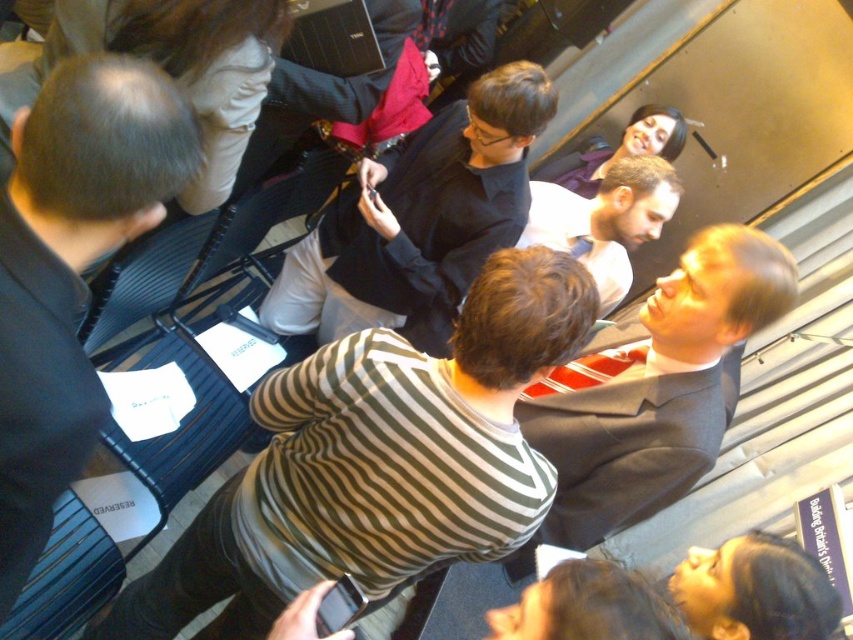
Does black shirt at left have a lesser width compared to black glossy shirt at center?

Yes, black shirt at left is thinner than black glossy shirt at center.

Find the location of a particular element. black shirt at left is located at coordinates (70, 269).

Find the location of a particular element. Image resolution: width=853 pixels, height=640 pixels. black shirt at left is located at coordinates (70, 269).

Find the location of a particular element. black shirt at left is located at coordinates (70, 269).

Is striped cotton shirt at center positioned before black glossy shirt at center?

That is True.

Measure the distance between striped cotton shirt at center and camera.

striped cotton shirt at center and camera are 3.61 feet apart.

The height and width of the screenshot is (640, 853). I want to click on striped cotton shirt at center, so click(x=376, y=461).

Where is `striped cotton shirt at center`? The height and width of the screenshot is (640, 853). striped cotton shirt at center is located at coordinates (376, 461).

Can you confirm if black shirt at left is shorter than dark gray suit at center?

In fact, black shirt at left may be taller than dark gray suit at center.

Is point (74, 381) positioned after point (612, 250)?

No, (74, 381) is in front of (612, 250).

Find the location of a particular element. This screenshot has height=640, width=853. black shirt at left is located at coordinates (70, 269).